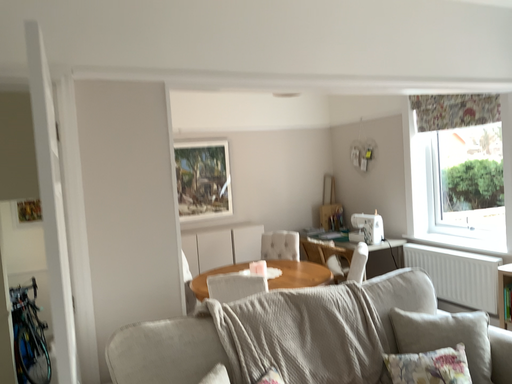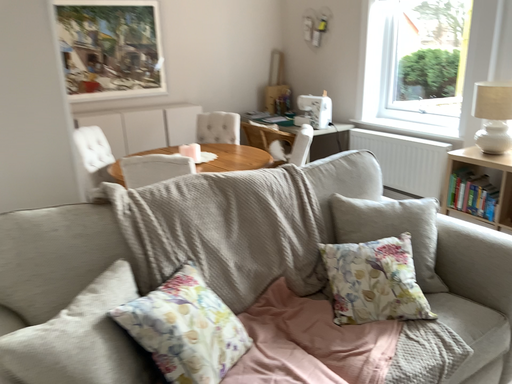
Question: Which way did the camera rotate in the video?

Choices:
 (A) rotated downward
 (B) rotated upward

Answer: (A)